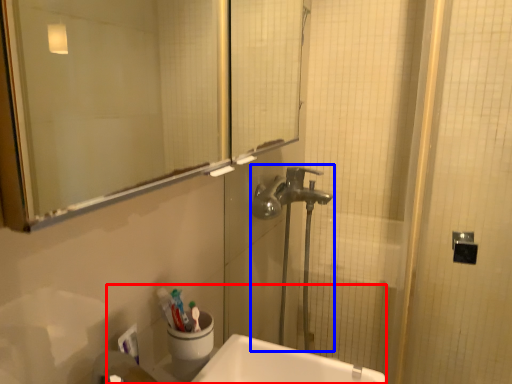
Question: Which object is closer to the camera taking this photo, sink (highlighted by a red box) or plumbing fixture (highlighted by a blue box)?

Choices:
 (A) sink
 (B) plumbing fixture

Answer: (A)